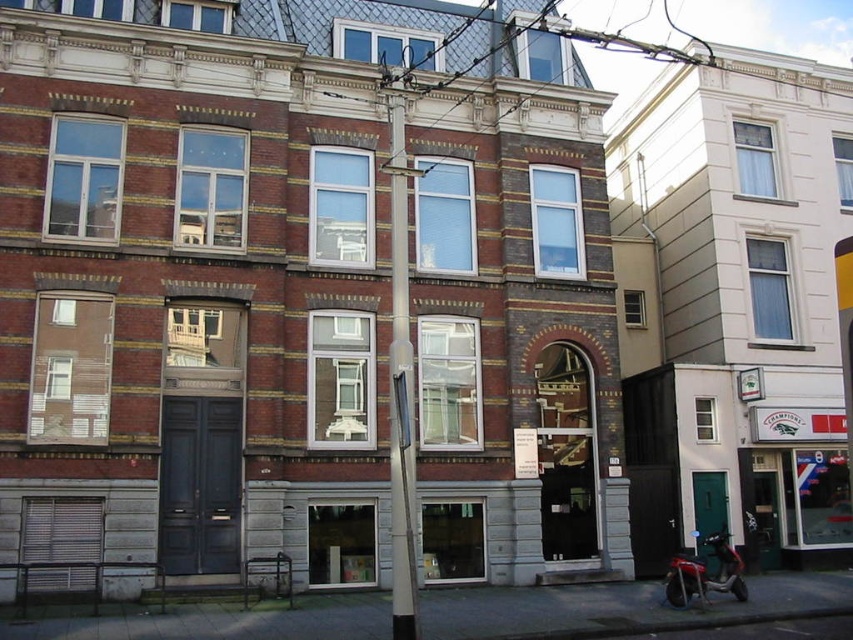
You are standing in front of the residential building and want to locate two specific points marked on the facade. The first point is at coordinates point (408,404) and the second is at point (724,579). Which of these two points is closer to you?

Point (408,404) is in front of point (724,579), so it is closer to you.

You are a delivery person who needs to park your metallic red scooter at lower right near the silver metallic pole at center without blocking the entrance. Considering their sizes, can you park the scooter close to the pole?

The silver metallic pole at center has a greater height compared to metallic red scooter at lower right, so yes, you can park the metallic red scooter at lower right close to the silver metallic pole at center without blocking the entrance as the pole is taller but not necessarily wider.

You are a delivery person trying to park your metallic red scooter at lower right near the entrance of the building. There is a silver metallic pole at center blocking the path. Can you move the scooter to the parking spot behind the pole?

The silver metallic pole at center is in front of the metallic red scooter at lower right, so the scooter cannot be moved to the parking spot behind the pole without first moving the pole.